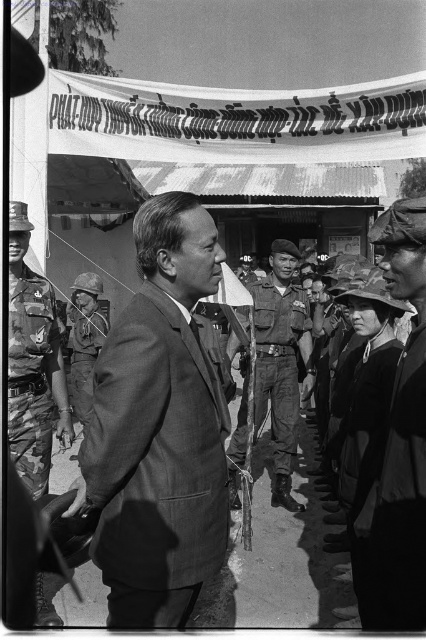
From the picture: Does dark gray uniform at center appear under uniformed soldier at center?

Actually, dark gray uniform at center is above uniformed soldier at center.

From the picture: Does dark gray uniform at center have a greater height compared to uniformed soldier at center?

Incorrect, dark gray uniform at center's height is not larger of uniformed soldier at center's.

Which is behind, point (405, 216) or point (288, 470)?

Positioned behind is point (288, 470).

This screenshot has width=426, height=640. In order to click on dark gray uniform at center in this screenshot , I will do `click(399, 445)`.

Is uniformed soldier at center closer to camera compared to camouflage fabric helmet at center?

That is False.

Who is higher up, uniformed soldier at center or camouflage fabric helmet at center?

camouflage fabric helmet at center

Does point (264, 324) come farther from viewer compared to point (78, 291)?

No, it is in front of (78, 291).

Locate an element on the screen. uniformed soldier at center is located at coordinates (282, 362).

Is point (425, 465) in front of point (51, 346)?

Yes, it is.

Who is lower down, dark gray uniform at center or camo uniform at left?

Positioned lower is dark gray uniform at center.

Is point (399, 496) less distant than point (34, 368)?

Yes.

The width and height of the screenshot is (426, 640). I want to click on dark gray uniform at center, so [399, 445].